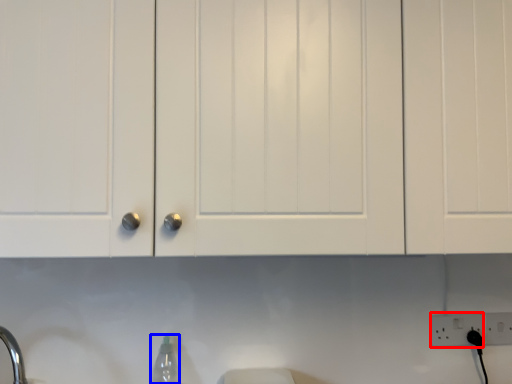
Question: Among these objects, which one is farthest to the camera, electric outlet (highlighted by a red box) or bottle (highlighted by a blue box)?

Choices:
 (A) electric outlet
 (B) bottle

Answer: (A)